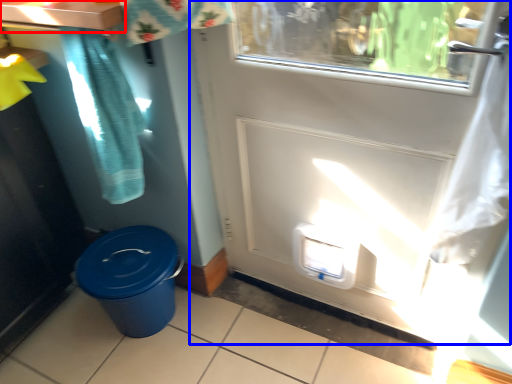
Question: Which point is closer to the camera, counter top (highlighted by a red box) or door (highlighted by a blue box)?

Choices:
 (A) counter top
 (B) door

Answer: (B)